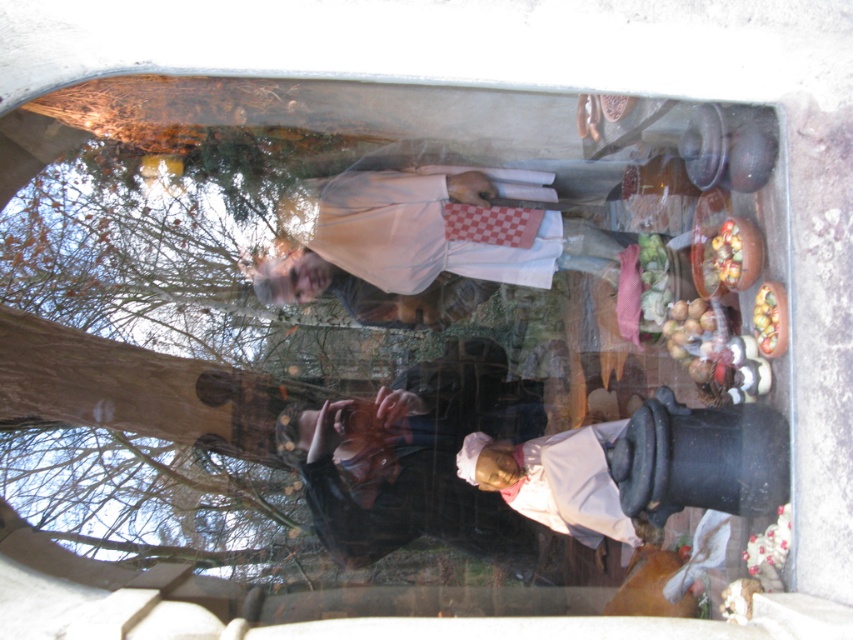
Question: Is matte white chef hat at center to the right of shiny metallic bowl at right from the viewer's perspective?

Choices:
 (A) yes
 (B) no

Answer: (B)

Question: Can you confirm if pink fabric headscarf at center is positioned to the left of shiny golden apples at right?

Choices:
 (A) yes
 (B) no

Answer: (A)

Question: Among these objects, which one is nearest to the camera?

Choices:
 (A) pink fabric headscarf at center
 (B) shiny golden apples at right
 (C) shiny metallic bowl at right
 (D) matte white chef hat at center

Answer: (B)

Question: Which object is closer to the camera taking this photo?

Choices:
 (A) shiny golden apples at right
 (B) matte white chef hat at center
 (C) pink fabric headscarf at center
 (D) shiny metallic bowl at right

Answer: (A)

Question: Which point appears closest to the camera in this image?

Choices:
 (A) (577, 458)
 (B) (726, 269)
 (C) (492, 353)
 (D) (769, 301)

Answer: (D)

Question: Does shiny golden apples at right lie in front of shiny metallic bowl at right?

Choices:
 (A) yes
 (B) no

Answer: (A)